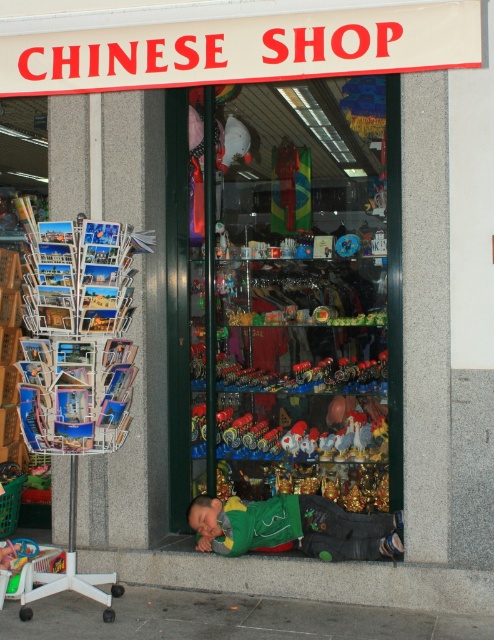
Question: Is gray concrete pavement at lower center below green fabric sleeping bag at lower center?

Choices:
 (A) yes
 (B) no

Answer: (A)

Question: Which point is farther to the camera?

Choices:
 (A) (296, 524)
 (B) (69, 609)

Answer: (A)

Question: Is gray concrete pavement at lower center behind green fabric sleeping bag at lower center?

Choices:
 (A) no
 (B) yes

Answer: (A)

Question: Does gray concrete pavement at lower center appear under green fabric sleeping bag at lower center?

Choices:
 (A) yes
 (B) no

Answer: (A)

Question: Among these objects, which one is farthest from the camera?

Choices:
 (A) green fabric sleeping bag at lower center
 (B) gray concrete pavement at lower center

Answer: (A)